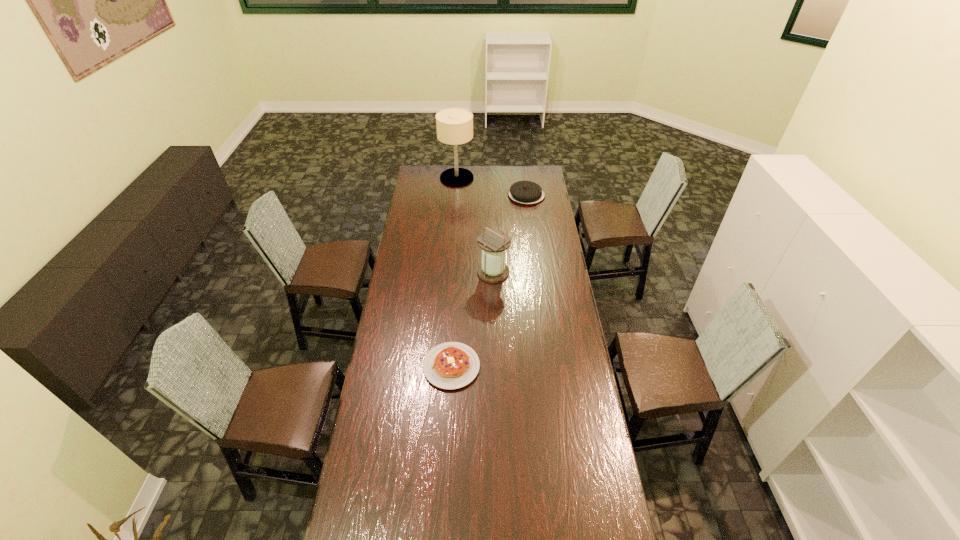
I want to click on table lamp, so click(x=454, y=126).

This screenshot has height=540, width=960. Find the location of `lantern`. lantern is located at coordinates (493, 243).

The image size is (960, 540). What are the coordinates of `the third shortest object` in the screenshot? It's located at (493, 243).

Locate an element on the screen. The image size is (960, 540). the farther pancake is located at coordinates (524, 192).

Locate an element on the screen. The height and width of the screenshot is (540, 960). the taller pancake is located at coordinates (524, 192).

Where is `the left pancake`? The height and width of the screenshot is (540, 960). the left pancake is located at coordinates (451, 365).

Locate an element on the screen. The height and width of the screenshot is (540, 960). the shorter pancake is located at coordinates [x=451, y=365].

Image resolution: width=960 pixels, height=540 pixels. What are the coordinates of `vacant region located 0.080m on the left of the table lamp` in the screenshot? It's located at (427, 178).

Where is `vacant region located on the left of the second nearest object`? This screenshot has width=960, height=540. vacant region located on the left of the second nearest object is located at coordinates (432, 272).

I want to click on vacant space located on the front of the farther pancake, so click(533, 245).